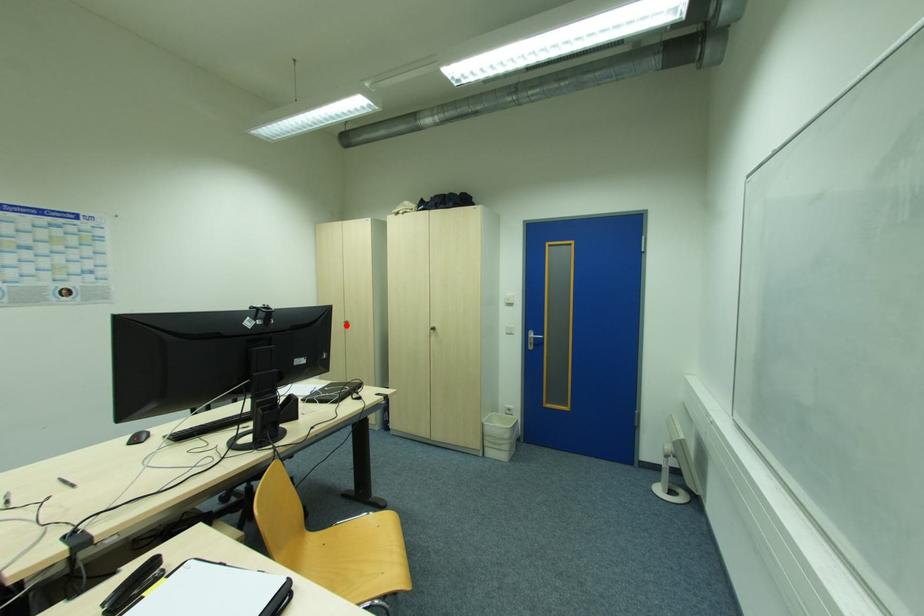
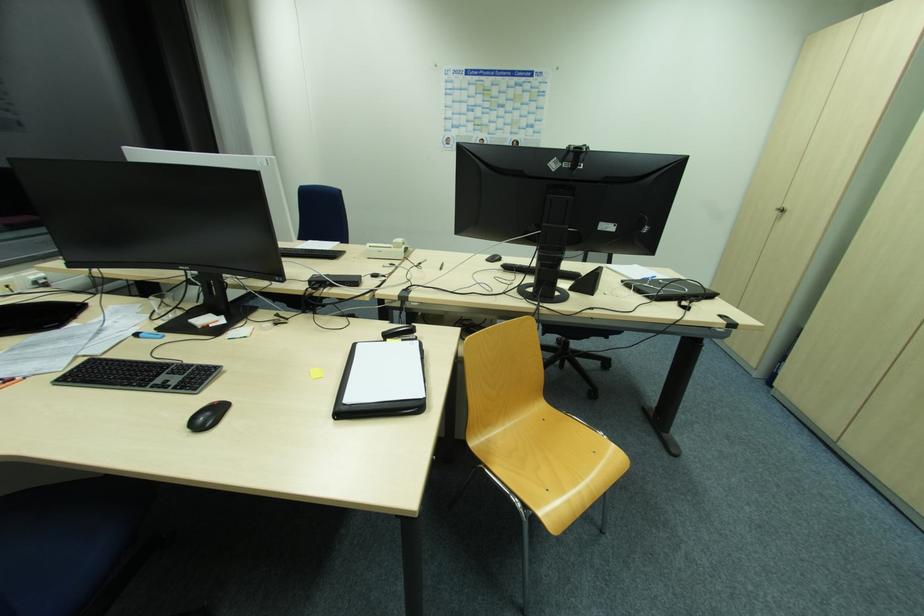
Question: I am providing you with two images of the same scene from different viewpoints. A red point is marked on the first image. At the location where the point appears in image 1, is it still visible in image 2?

Choices:
 (A) Yes
 (B) No

Answer: (A)